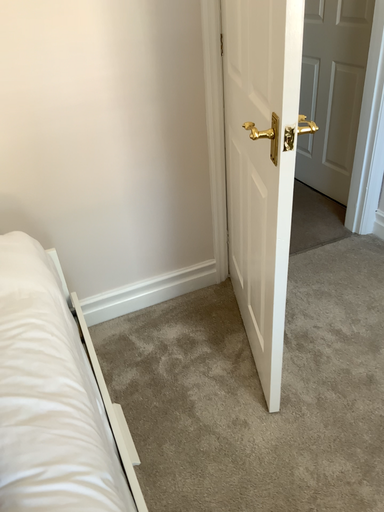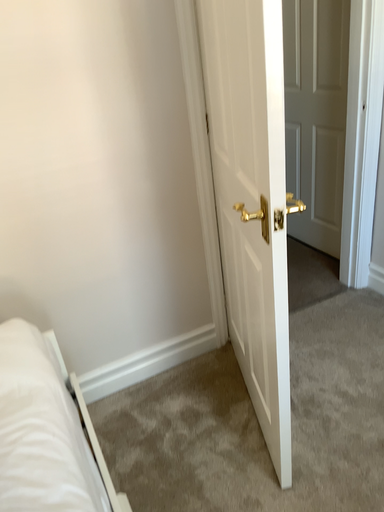
Question: How did the camera likely rotate when shooting the video?

Choices:
 (A) rotated downward
 (B) rotated upward

Answer: (B)